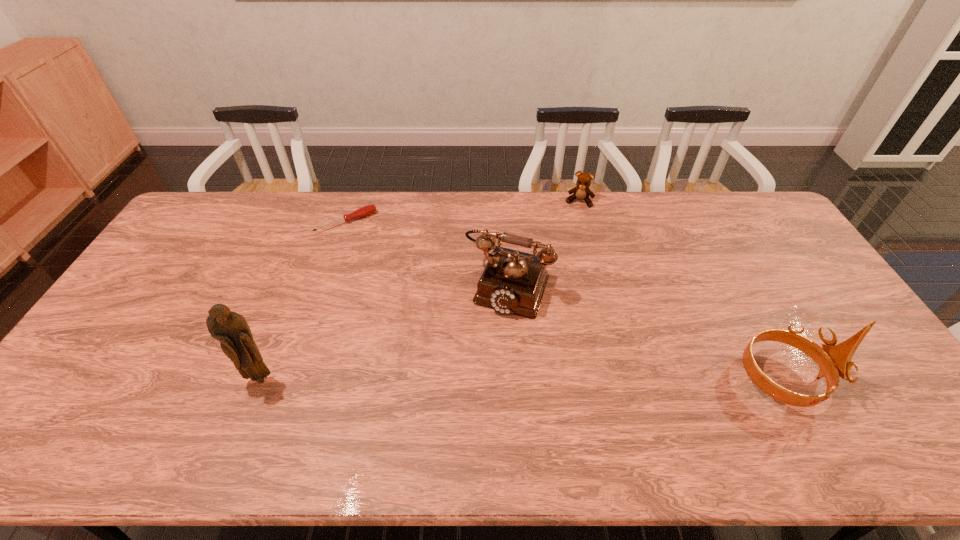
Find the location of a particular element. teddy bear present at the far edge is located at coordinates (581, 192).

Where is `figurine positioned at the near edge`? This screenshot has width=960, height=540. figurine positioned at the near edge is located at coordinates (230, 328).

Image resolution: width=960 pixels, height=540 pixels. I want to click on tiara at the near edge, so click(833, 360).

Find the location of a particular element. The width and height of the screenshot is (960, 540). vacant space at the far edge is located at coordinates (562, 206).

The image size is (960, 540). I want to click on free space at the near edge of the desktop, so click(x=811, y=384).

The height and width of the screenshot is (540, 960). Find the location of `free space at the left edge of the desktop`. free space at the left edge of the desktop is located at coordinates (219, 236).

I want to click on vacant position at the right edge of the desktop, so click(x=812, y=294).

At what (x,y) coordinates should I click in order to perform the action: click on vacant space at the far left corner of the desktop. Please return your answer as a coordinate pair (x, y). The width and height of the screenshot is (960, 540). Looking at the image, I should click on (228, 204).

At what (x,y) coordinates should I click in order to perform the action: click on blank space at the near right corner of the desktop. Please return your answer as a coordinate pair (x, y). Looking at the image, I should click on (843, 400).

You are a GUI agent. You are given a task and a screenshot of the screen. Output one action in this format:
    pyautogui.click(x=<x>, y=<y>)
    Task: Click on the vacant area that lies between the figurine and the third nearest object
    The height and width of the screenshot is (540, 960).
    Given the screenshot: What is the action you would take?
    pyautogui.click(x=384, y=332)